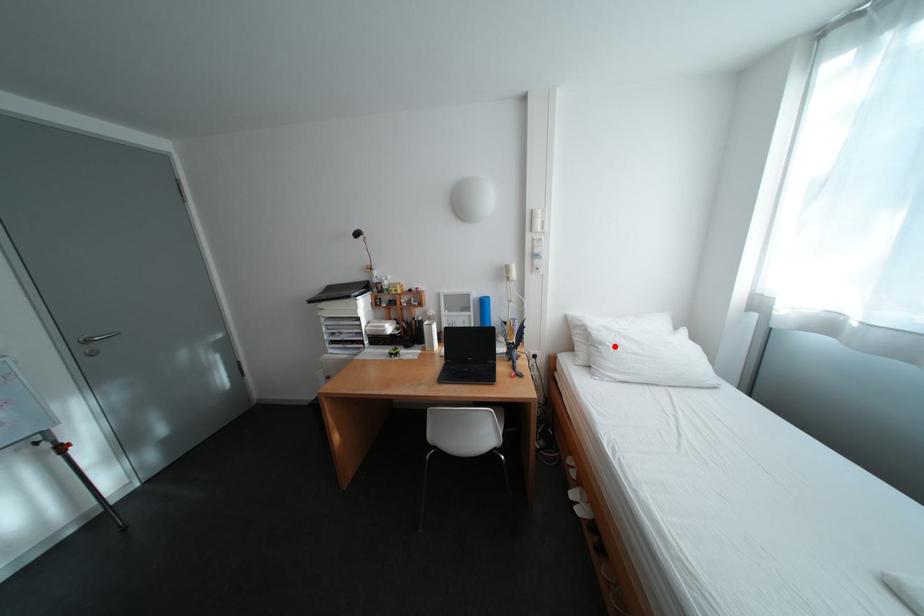
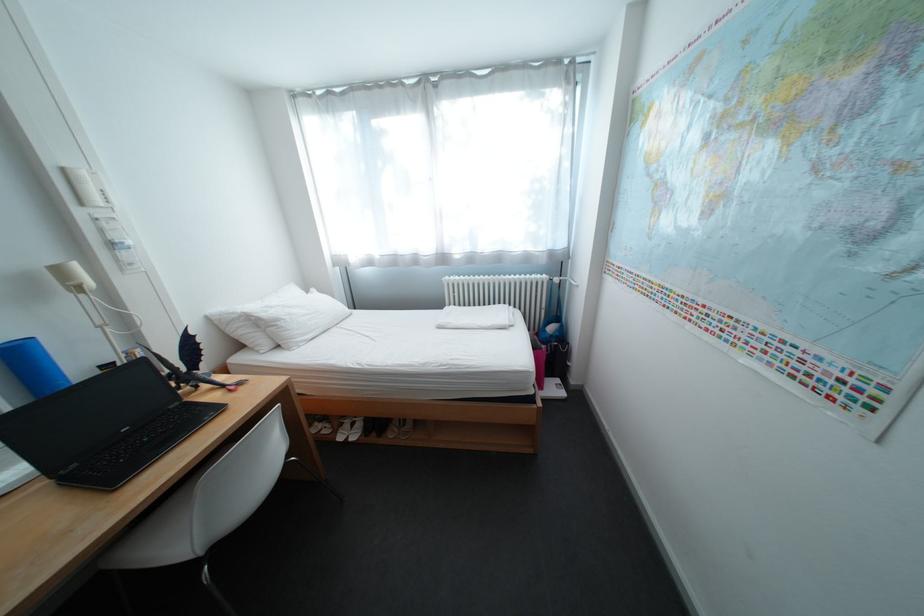
In the second image, find the point that corresponds to the highlighted location in the first image.

(292, 322)